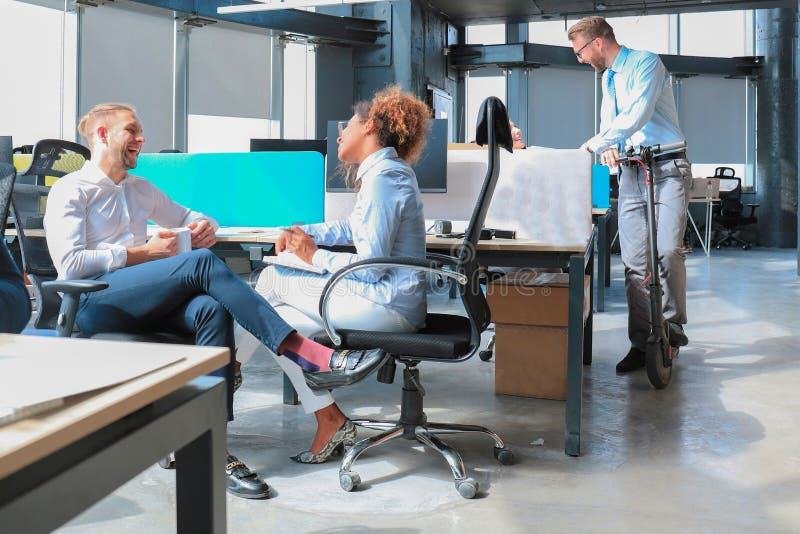
The height and width of the screenshot is (534, 800). In order to click on metal framed desk with wooden top in this screenshot , I will do `click(166, 433)`, `click(144, 378)`, `click(218, 460)`, `click(221, 383)`.